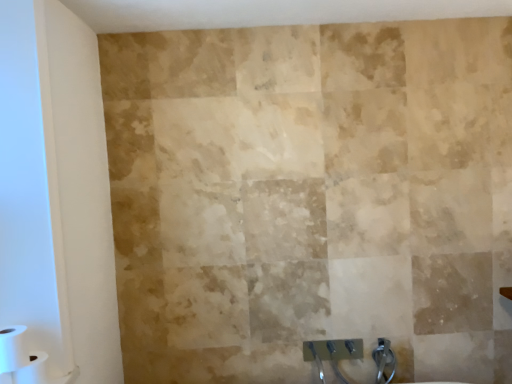
Question: Does white matte toilet paper at lower left, which appears as the 2th toilet paper when ordered from the bottom, have a lesser height compared to transparent glass door at left?

Choices:
 (A) yes
 (B) no

Answer: (A)

Question: Is white matte toilet paper at lower left, which is the 1th toilet paper in top-to-bottom order, further to the viewer compared to transparent glass door at left?

Choices:
 (A) no
 (B) yes

Answer: (B)

Question: From a real-world perspective, is white matte toilet paper at lower left, which appears as the 2th toilet paper when ordered from the bottom, over transparent glass door at left?

Choices:
 (A) no
 (B) yes

Answer: (A)

Question: Is transparent glass door at left at the back of white matte toilet paper at lower left, which appears as the 2th toilet paper when ordered from the bottom?

Choices:
 (A) yes
 (B) no

Answer: (B)

Question: Considering the relative sizes of white matte toilet paper at lower left, which is the 1th toilet paper in top-to-bottom order, and transparent glass door at left in the image provided, is white matte toilet paper at lower left, which is the 1th toilet paper in top-to-bottom order, bigger than transparent glass door at left?

Choices:
 (A) no
 (B) yes

Answer: (A)

Question: Is white matte toilet paper at lower left, which is the 1th toilet paper in top-to-bottom order, taller or shorter than white matte toilet paper at lower left, arranged as the 1th toilet paper when ordered from the bottom?

Choices:
 (A) short
 (B) tall

Answer: (A)

Question: Looking at their shapes, would you say white matte toilet paper at lower left, which is the 1th toilet paper in top-to-bottom order, is wider or thinner than white matte toilet paper at lower left, the 2th toilet paper from the top?

Choices:
 (A) wide
 (B) thin

Answer: (B)

Question: Does point (8, 352) appear closer or farther from the camera than point (35, 359)?

Choices:
 (A) farther
 (B) closer

Answer: (B)

Question: Is white matte toilet paper at lower left, which is the 1th toilet paper in top-to-bottom order, in front of or behind white matte toilet paper at lower left, arranged as the 1th toilet paper when ordered from the bottom, in the image?

Choices:
 (A) front
 (B) behind

Answer: (A)

Question: Considering the positions of point (13, 337) and point (4, 228), is point (13, 337) closer or farther from the camera than point (4, 228)?

Choices:
 (A) closer
 (B) farther

Answer: (B)

Question: Would you say white matte toilet paper at lower left, which appears as the 2th toilet paper when ordered from the bottom, is inside or outside transparent glass door at left?

Choices:
 (A) inside
 (B) outside

Answer: (B)

Question: From their relative heights in the image, would you say white matte toilet paper at lower left, which is the 1th toilet paper in top-to-bottom order, is taller or shorter than transparent glass door at left?

Choices:
 (A) short
 (B) tall

Answer: (A)

Question: Is white matte toilet paper at lower left, which is the 1th toilet paper in top-to-bottom order, bigger or smaller than transparent glass door at left?

Choices:
 (A) big
 (B) small

Answer: (B)

Question: In terms of width, does white matte toilet paper at lower left, arranged as the 1th toilet paper when ordered from the bottom, look wider or thinner when compared to transparent glass door at left?

Choices:
 (A) thin
 (B) wide

Answer: (B)

Question: From a real-world perspective, is white matte toilet paper at lower left, the 2th toilet paper from the top, positioned above or below transparent glass door at left?

Choices:
 (A) above
 (B) below

Answer: (B)